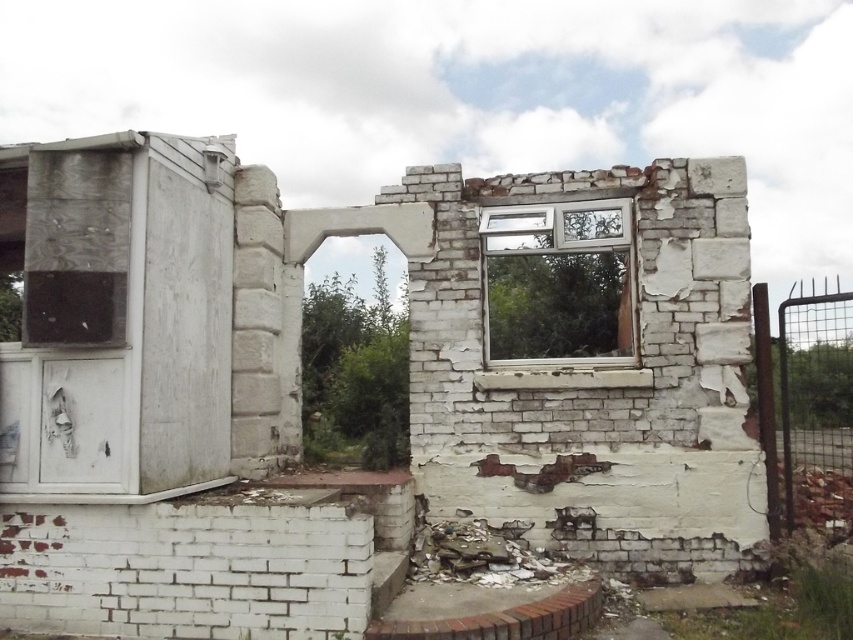
Question: Among these objects, which one is farthest from the camera?

Choices:
 (A) white cracked brick ruins at center
 (B) clear glass window at center

Answer: (B)

Question: Which object appears farthest from the camera in this image?

Choices:
 (A) white cracked brick ruins at center
 (B) clear glass window at center

Answer: (B)

Question: Can you confirm if white cracked brick ruins at center is positioned to the left of clear glass window at center?

Choices:
 (A) yes
 (B) no

Answer: (A)

Question: Is white cracked brick ruins at center positioned at the back of clear glass window at center?

Choices:
 (A) no
 (B) yes

Answer: (A)

Question: Where is white cracked brick ruins at center located in relation to clear glass window at center in the image?

Choices:
 (A) left
 (B) right

Answer: (A)

Question: Which point is closer to the camera?

Choices:
 (A) clear glass window at center
 (B) white cracked brick ruins at center

Answer: (B)